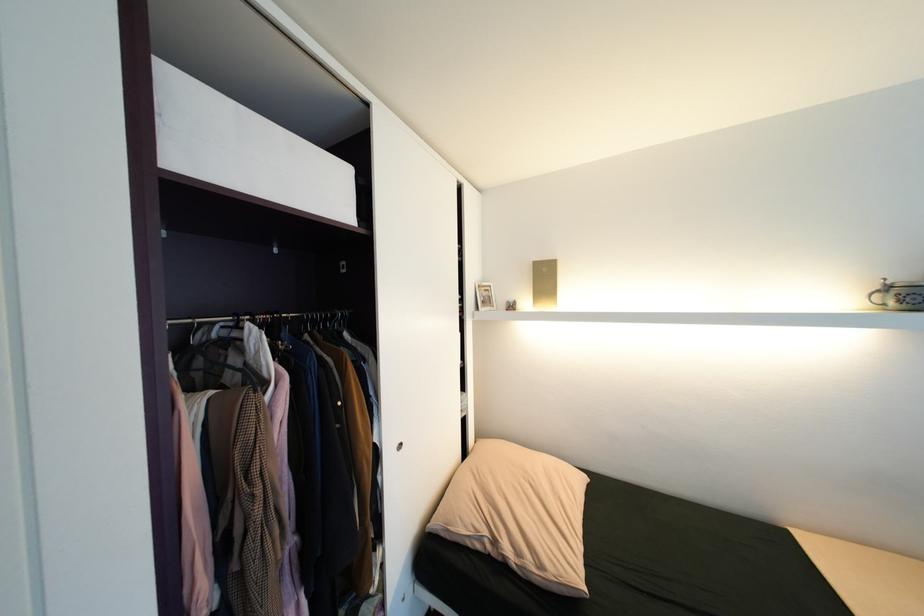
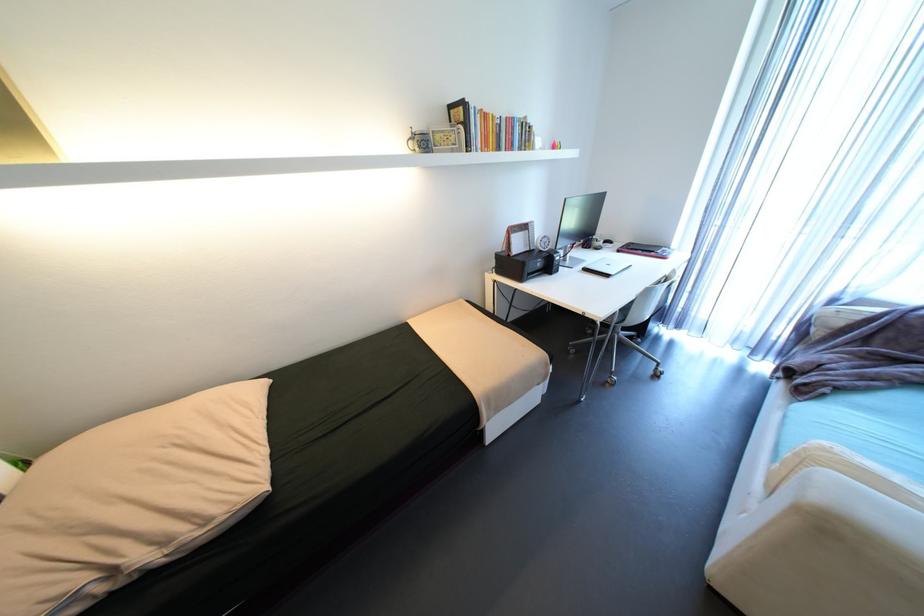
Based on the continuous images, in which direction is the camera rotating?

The rotation direction of the camera is right-down.